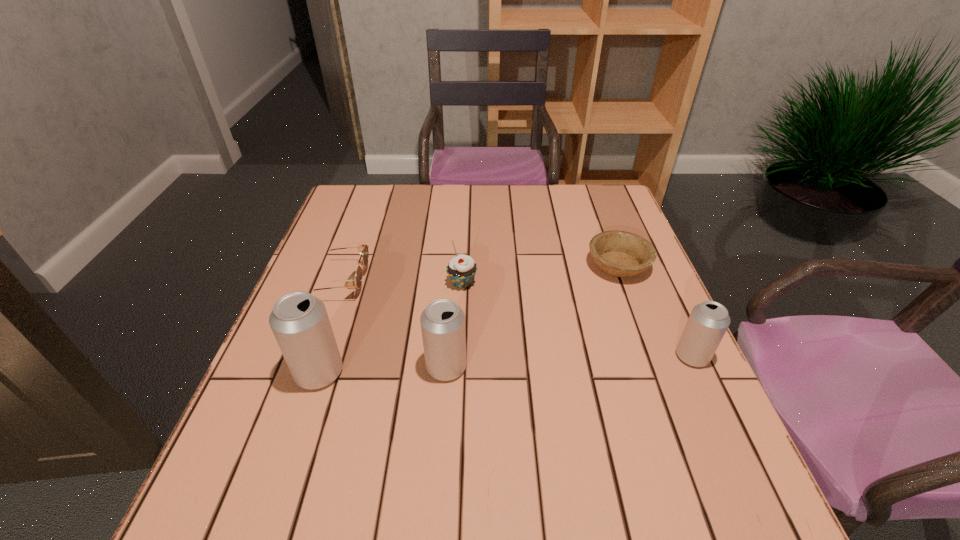
This screenshot has width=960, height=540. I want to click on free space at the right edge of the desktop, so click(609, 334).

I want to click on free spot at the far left corner of the desktop, so click(386, 186).

Identify the location of vacant region at the near left corner of the desktop. (311, 465).

The image size is (960, 540). I want to click on vacant area at the far right corner of the desktop, so click(x=579, y=215).

Image resolution: width=960 pixels, height=540 pixels. Identify the location of empty location between the second shortest object and the bowl. (479, 273).

Where is `free space between the leftmost beer can and the bowl`? This screenshot has height=540, width=960. free space between the leftmost beer can and the bowl is located at coordinates 468,319.

Find the location of a particular element. The image size is (960, 540). free spot between the fourth shortest object and the second tallest beer can is located at coordinates (569, 361).

Image resolution: width=960 pixels, height=540 pixels. I want to click on vacant area that lies between the second beer can from left to right and the fifth tallest object, so click(393, 324).

This screenshot has width=960, height=540. Find the location of `free point between the fourth tallest object and the leftmost beer can`. free point between the fourth tallest object and the leftmost beer can is located at coordinates (391, 328).

Identify the location of free space between the second shortest beer can and the rightmost beer can. (569, 361).